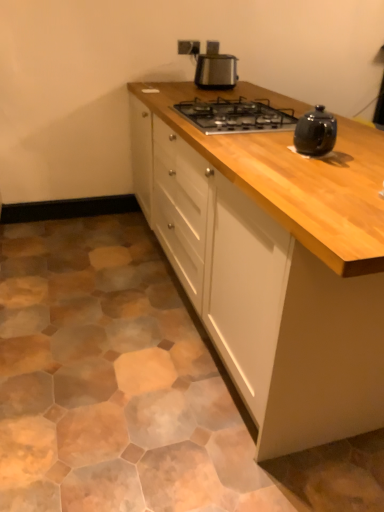
What do you see at coordinates (278, 266) in the screenshot? I see `white wood cabinet at center` at bounding box center [278, 266].

Identify the location of white wood cabinet at center. (278, 266).

Considering the points (256, 163) and (257, 116), which point is behind, point (256, 163) or point (257, 116)?

The point (257, 116) is behind.

In the scene shown: From a real-world perspective, who is located lower, white wood cabinet at center or black metal gas stove at center?

From a 3D spatial view, white wood cabinet at center is below.

From the picture: Does white wood cabinet at center turn towards black metal gas stove at center?

No, white wood cabinet at center is not facing towards black metal gas stove at center.

Would you consider white wood cabinet at center to be distant from satin metallic toaster at upper center?

white wood cabinet at center is positioned a significant distance from satin metallic toaster at upper center.

From the image's perspective, is white wood cabinet at center positioned above or below satin metallic toaster at upper center?

Clearly, from the image's perspective, white wood cabinet at center is below satin metallic toaster at upper center.

How many degrees apart are the facing directions of white wood cabinet at center and satin metallic toaster at upper center?

The angular difference between white wood cabinet at center and satin metallic toaster at upper center is 90 degrees.

Considering the relative sizes of white wood cabinet at center and satin metallic toaster at upper center in the image provided, is white wood cabinet at center wider than satin metallic toaster at upper center?

Indeed, white wood cabinet at center has a greater width compared to satin metallic toaster at upper center.

Does satin metallic toaster at upper center come behind black metal gas stove at center?

That is True.

Would you say satin metallic toaster at upper center contains black metal gas stove at center?

That's incorrect, black metal gas stove at center is not inside satin metallic toaster at upper center.

Is satin metallic toaster at upper center next to black metal gas stove at center and touching it?

satin metallic toaster at upper center is not next to black metal gas stove at center, and they're not touching.

Considering the positions of objects satin metallic toaster at upper center and white wood cabinet at center in the image provided, who is behind, satin metallic toaster at upper center or white wood cabinet at center?

satin metallic toaster at upper center is further away from the camera.

From the picture: From the image's perspective, does satin metallic toaster at upper center appear higher than white wood cabinet at center?

Correct, satin metallic toaster at upper center appears higher than white wood cabinet at center in the image.

Is satin metallic toaster at upper center placed right next to white wood cabinet at center?

satin metallic toaster at upper center and white wood cabinet at center are not in contact.

Does satin metallic toaster at upper center have a larger size compared to white wood cabinet at center?

Actually, satin metallic toaster at upper center might be smaller than white wood cabinet at center.

From a real-world perspective, which is physically above, black metal gas stove at center or white wood cabinet at center?

black metal gas stove at center, from a real-world perspective.

How much distance is there between black metal gas stove at center and white wood cabinet at center?

The distance of black metal gas stove at center from white wood cabinet at center is 18.25 inches.

From the image's perspective, is black metal gas stove at center on white wood cabinet at center?

Yes.

Identify the location of gas stove positioned vertically above the white wood cabinet at center (from a real-world perspective). (236, 115).

Does black metal gas stove at center have a lesser height compared to satin metallic toaster at upper center?

Indeed, black metal gas stove at center has a lesser height compared to satin metallic toaster at upper center.

Looking at the image, does black metal gas stove at center seem bigger or smaller compared to satin metallic toaster at upper center?

Clearly, black metal gas stove at center is larger in size than satin metallic toaster at upper center.

From a real-world perspective, is black metal gas stove at center on top of satin metallic toaster at upper center?

No.

You are a GUI agent. You are given a task and a screenshot of the screen. Output one action in this format:
    pyautogui.click(x=<x>, y=<y>)
    Task: Click on the gas stove above the white wood cabinet at center (from a real-world perspective)
    
    Given the screenshot: What is the action you would take?
    pyautogui.click(x=236, y=115)

The image size is (384, 512). I want to click on cabinetry beneath the satin metallic toaster at upper center (from a real-world perspective), so click(278, 266).

From the image, which object appears to be farther from black metal gas stove at center, white wood cabinet at center or satin metallic toaster at upper center?

satin metallic toaster at upper center is positioned further to the anchor black metal gas stove at center.

Looking at the image, which one is located closer to satin metallic toaster at upper center, white wood cabinet at center or black metal gas stove at center?

The object closer to satin metallic toaster at upper center is black metal gas stove at center.

Considering their positions, is satin metallic toaster at upper center positioned closer to white wood cabinet at center than black metal gas stove at center?

black metal gas stove at center.

Looking at the image, which one is located further to white wood cabinet at center, black metal gas stove at center or satin metallic toaster at upper center?

satin metallic toaster at upper center lies further to white wood cabinet at center than the other object.

From the image, which object appears to be nearer to black metal gas stove at center, satin metallic toaster at upper center or white wood cabinet at center?

Among the two, white wood cabinet at center is located nearer to black metal gas stove at center.

Looking at the image, which one is located further to satin metallic toaster at upper center, black metal gas stove at center or white wood cabinet at center?

Among the two, white wood cabinet at center is located further to satin metallic toaster at upper center.

You are a GUI agent. You are given a task and a screenshot of the screen. Output one action in this format:
    pyautogui.click(x=<x>, y=<y>)
    Task: Click on the gas stove between white wood cabinet at center and satin metallic toaster at upper center along the z-axis
    
    Given the screenshot: What is the action you would take?
    pyautogui.click(x=236, y=115)